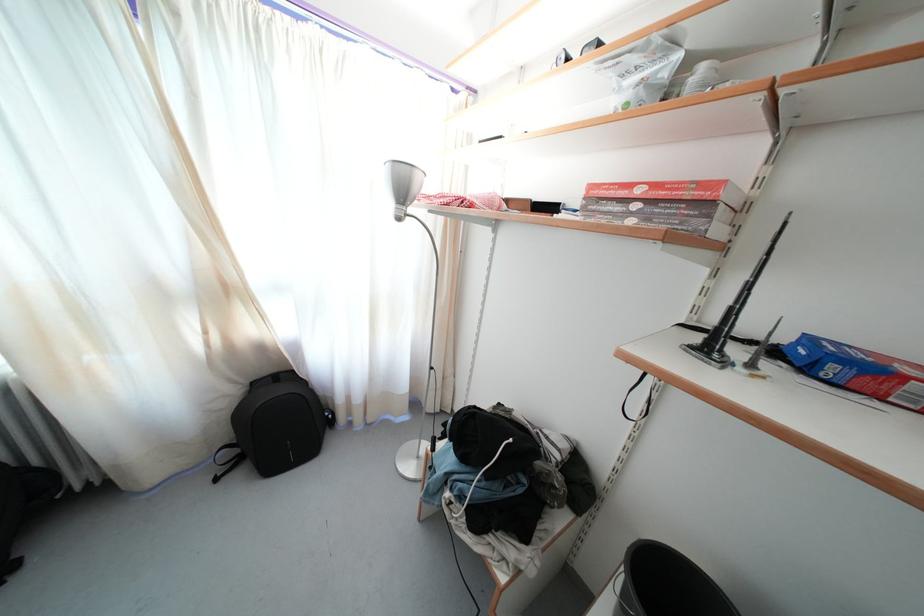
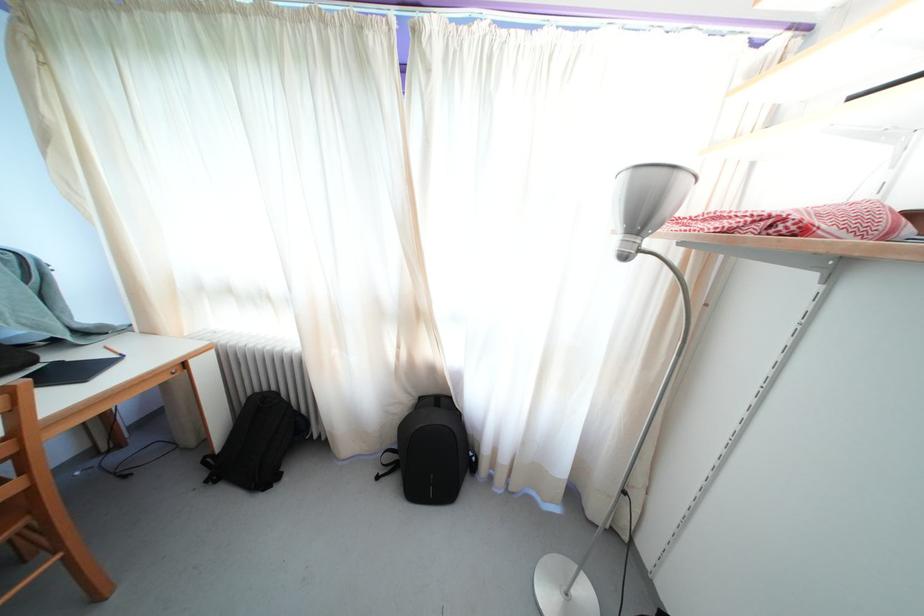
In the second image, find the point that corresponds to pixel 408 199 in the first image.

(648, 223)